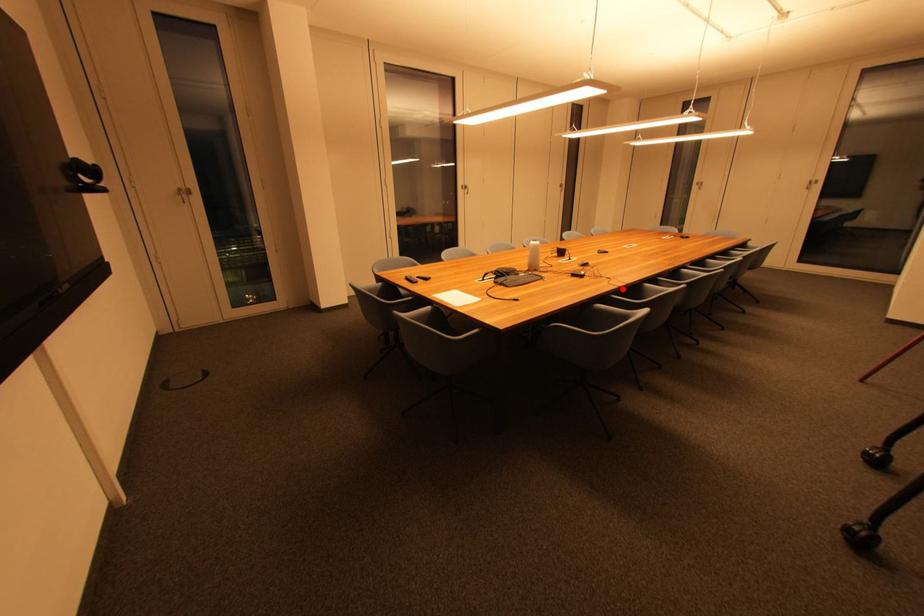
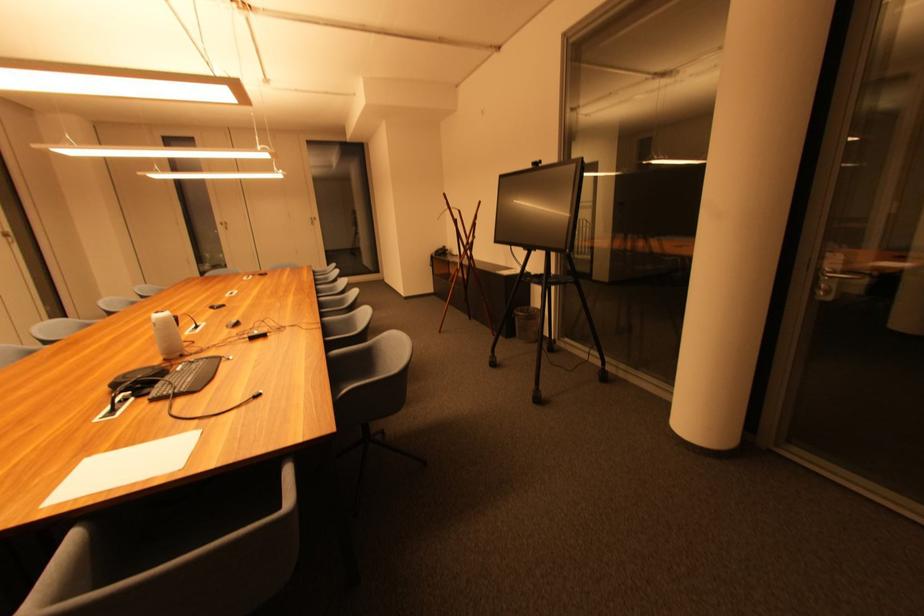
Locate, in the second image, the point that corresponds to the highlighted location in the first image.

(325, 331)